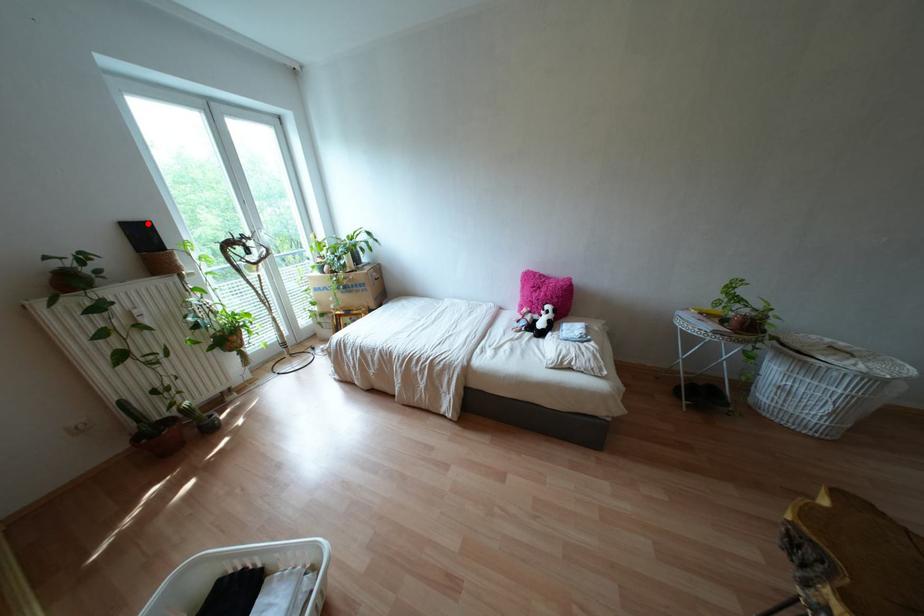
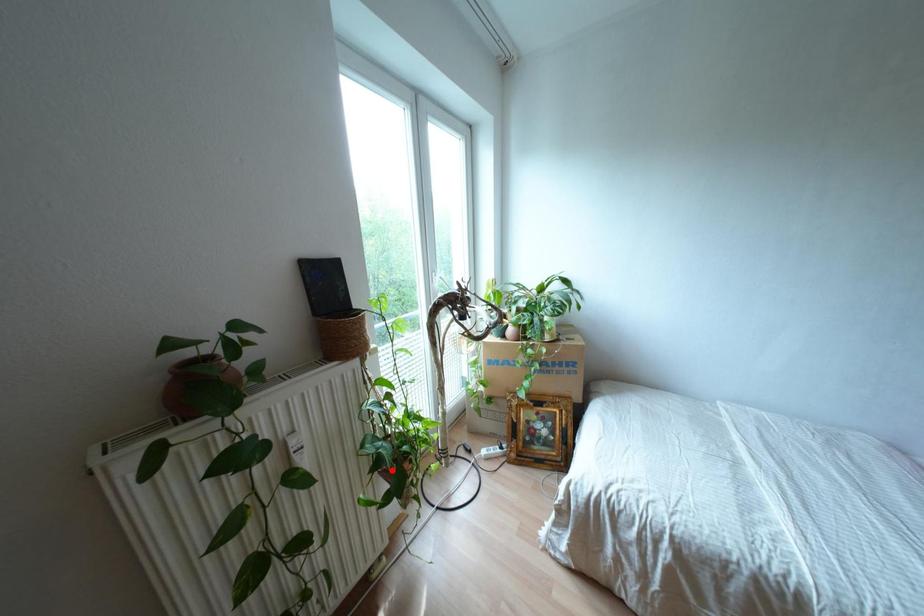
I am providing you with two images of the same scene from different viewpoints. A red point is marked on the first image and another point is marked on the second image. Do the highlighted points in image1 and image2 indicate the same real-world spot?

No